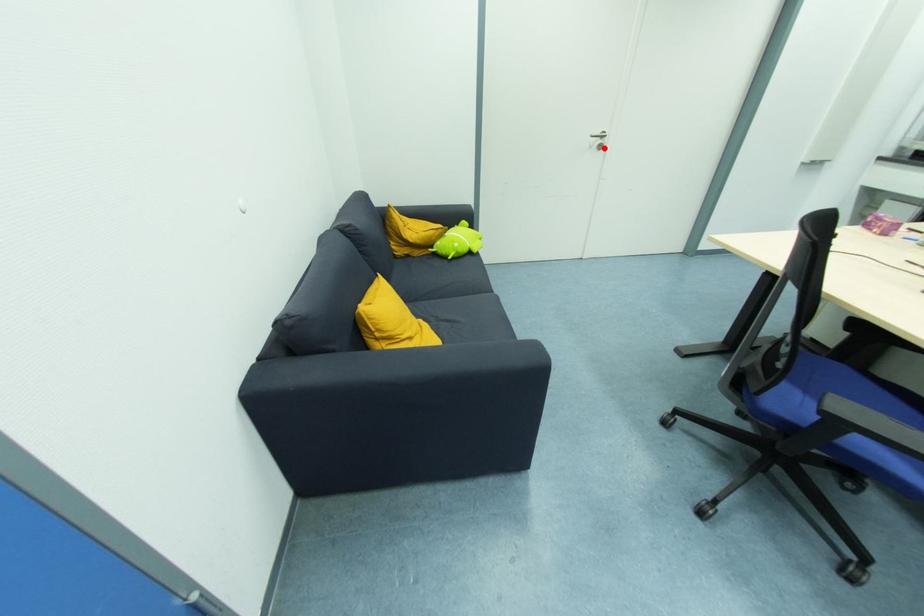
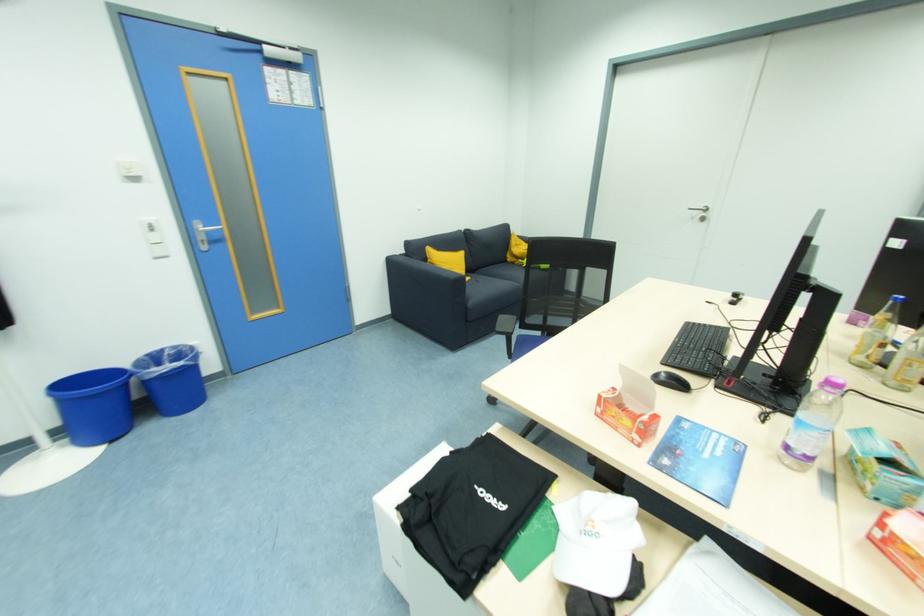
Where in the second image is the point corresponding to the highlighted location from the first image?

(706, 221)